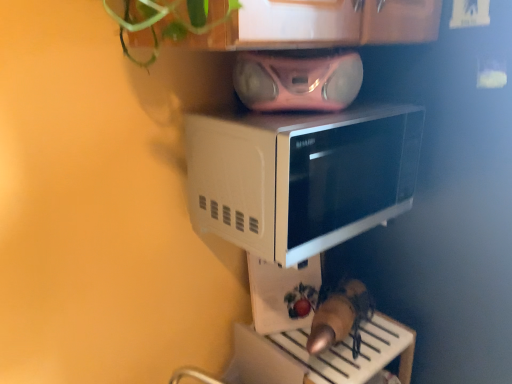
Question: From a real-world perspective, is white glossy microwave at upper center located higher than white glossy microwave at center?

Choices:
 (A) yes
 (B) no

Answer: (A)

Question: Is white glossy microwave at center a part of white glossy microwave at upper center?

Choices:
 (A) yes
 (B) no

Answer: (B)

Question: Is white glossy microwave at upper center oriented away from white glossy microwave at center?

Choices:
 (A) no
 (B) yes

Answer: (A)

Question: Does white glossy microwave at upper center have a larger size compared to white glossy microwave at center?

Choices:
 (A) no
 (B) yes

Answer: (B)

Question: Is the position of white glossy microwave at upper center less distant than that of white glossy microwave at center?

Choices:
 (A) no
 (B) yes

Answer: (B)

Question: In terms of width, does white glossy microwave at upper center look wider or thinner when compared to white glossy microwave at center?

Choices:
 (A) thin
 (B) wide

Answer: (B)

Question: From a real-world perspective, is white glossy microwave at upper center positioned above or below white glossy microwave at center?

Choices:
 (A) below
 (B) above

Answer: (B)

Question: Is white glossy microwave at upper center taller or shorter than white glossy microwave at center?

Choices:
 (A) short
 (B) tall

Answer: (A)

Question: Considering the positions of white glossy microwave at upper center and white glossy microwave at center in the image, is white glossy microwave at upper center bigger or smaller than white glossy microwave at center?

Choices:
 (A) big
 (B) small

Answer: (A)

Question: Is white glossy microwave at upper center in front of or behind pink metallic stereo at upper center in the image?

Choices:
 (A) front
 (B) behind

Answer: (A)

Question: Considering the positions of white glossy microwave at upper center and pink metallic stereo at upper center in the image, is white glossy microwave at upper center bigger or smaller than pink metallic stereo at upper center?

Choices:
 (A) big
 (B) small

Answer: (A)

Question: From a real-world perspective, is white glossy microwave at upper center positioned above or below pink metallic stereo at upper center?

Choices:
 (A) above
 (B) below

Answer: (B)

Question: Considering the relative positions of white glossy microwave at upper center and pink metallic stereo at upper center in the image provided, is white glossy microwave at upper center to the left or to the right of pink metallic stereo at upper center?

Choices:
 (A) right
 (B) left

Answer: (A)

Question: Based on their positions, is white glossy microwave at center located to the left or right of pink metallic stereo at upper center?

Choices:
 (A) right
 (B) left

Answer: (B)

Question: From a real-world perspective, is white glossy microwave at center positioned above or below pink metallic stereo at upper center?

Choices:
 (A) below
 (B) above

Answer: (A)